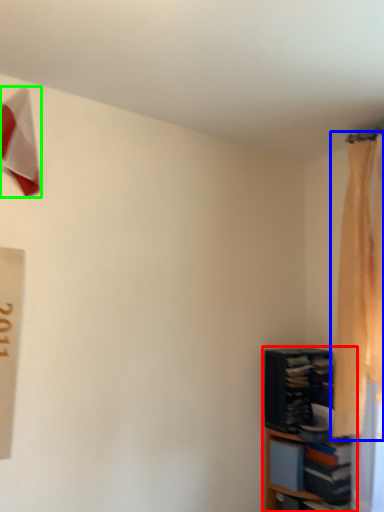
Question: Considering the real-world distances, which object is closest to shelf (highlighted by a red box)? curtain (highlighted by a blue box) or twin (highlighted by a green box).

Choices:
 (A) curtain
 (B) twin

Answer: (A)